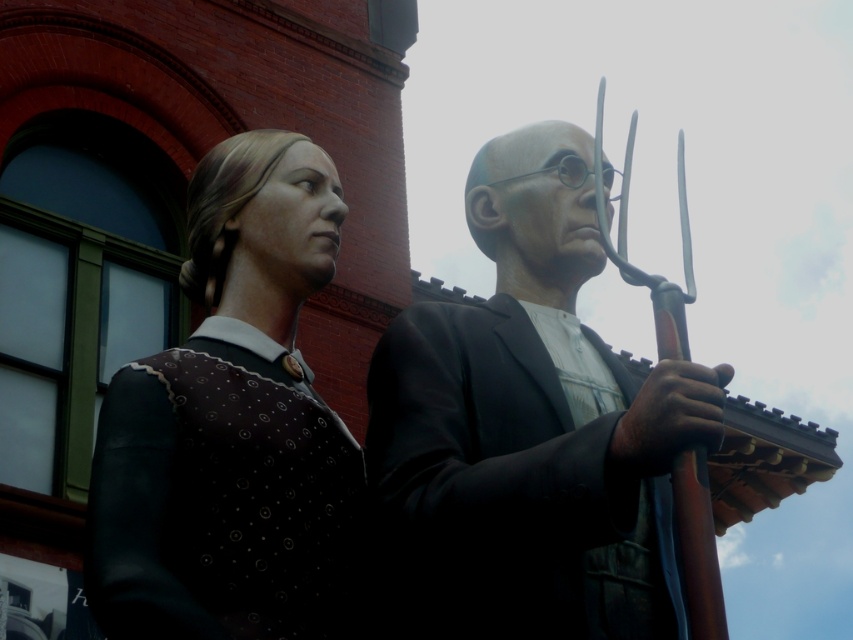
Question: Does matte black suit at center appear over matte brown vest at left?

Choices:
 (A) yes
 (B) no

Answer: (A)

Question: Does matte black suit at center appear on the right side of matte brown vest at left?

Choices:
 (A) no
 (B) yes

Answer: (B)

Question: Does matte black suit at center appear on the left side of matte brown vest at left?

Choices:
 (A) no
 (B) yes

Answer: (A)

Question: Which object appears closest to the camera in this image?

Choices:
 (A) matte black suit at center
 (B) matte brown vest at left

Answer: (B)